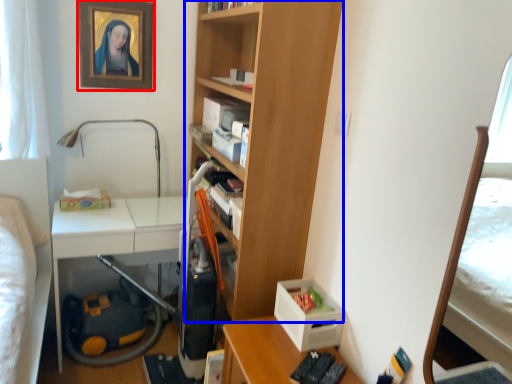
Question: Which object appears farthest to the camera in this image, picture frame (highlighted by a red box) or bookcase (highlighted by a blue box)?

Choices:
 (A) picture frame
 (B) bookcase

Answer: (A)